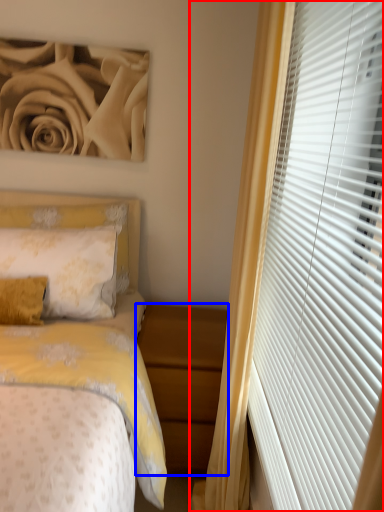
Question: Which point is further to the camera, curtain (highlighted by a red box) or nightstand (highlighted by a blue box)?

Choices:
 (A) curtain
 (B) nightstand

Answer: (B)